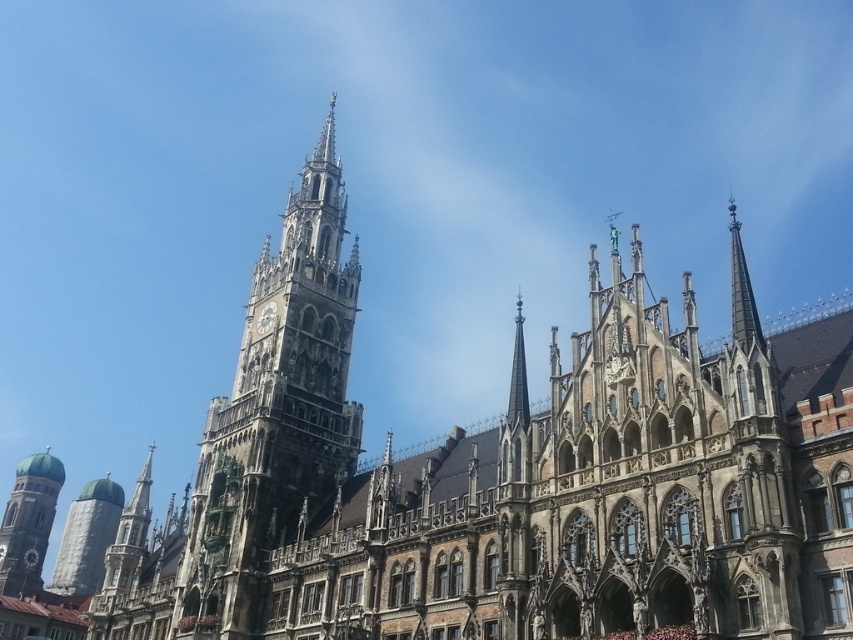
Question: Is stone gothic tower at center bigger than green domed tower at lower left?

Choices:
 (A) yes
 (B) no

Answer: (A)

Question: Is silver metallic tower at lower left smaller than smooth gray spire at center?

Choices:
 (A) no
 (B) yes

Answer: (A)

Question: Which point is closer to the camera?

Choices:
 (A) smooth gray spire at center
 (B) silver metallic tower at lower left
 (C) green domed tower at lower left

Answer: (A)

Question: Which object is farther from the camera taking this photo?

Choices:
 (A) green domed tower at lower left
 (B) smooth gray spire at center
 (C) silver metallic tower at lower left

Answer: (C)

Question: Which object is positioned farthest from the silver metallic tower at lower left?

Choices:
 (A) stone gothic tower at center
 (B) smooth gray spire at center
 (C) green domed tower at lower left

Answer: (B)

Question: Does green domed tower at lower left have a smaller size compared to silver metallic tower at lower left?

Choices:
 (A) yes
 (B) no

Answer: (A)